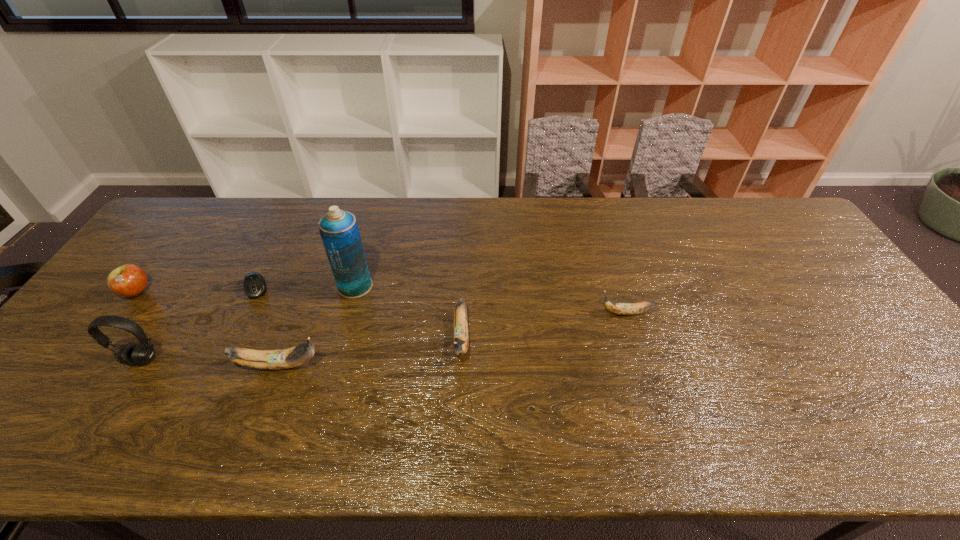
Where is `free space between the third tallest object and the shortest object`? Image resolution: width=960 pixels, height=540 pixels. free space between the third tallest object and the shortest object is located at coordinates (267, 327).

I want to click on vacant space that is in between the aerosol can and the third tallest object, so click(317, 326).

Find the location of `free space between the shortest banana and the mouse`. free space between the shortest banana and the mouse is located at coordinates (442, 301).

Find the location of `vacant space in between the leftmost object and the shortest banana`. vacant space in between the leftmost object and the shortest banana is located at coordinates (381, 302).

I want to click on free area in between the third tallest object and the tallest object, so click(x=317, y=326).

Locate an element on the screen. vacant area between the tallest object and the sixth object from left to right is located at coordinates (408, 312).

The height and width of the screenshot is (540, 960). Find the location of `object that stands as the fourth closest to the rightmost object`. object that stands as the fourth closest to the rightmost object is located at coordinates (254, 286).

Locate an element on the screen. The height and width of the screenshot is (540, 960). object that is the fourth closest one to the aerosol can is located at coordinates (142, 353).

Select which banana is the second closest to the tallest object. Please provide its 2D coordinates. Your answer should be formatted as a tuple, i.e. [(x, y)], where the tuple contains the x and y coordinates of a point satisfying the conditions above.

[(460, 343)]

Identify which banana is the second closest to the shortest banana. Please provide its 2D coordinates. Your answer should be formatted as a tuple, i.e. [(x, y)], where the tuple contains the x and y coordinates of a point satisfying the conditions above.

[(291, 357)]